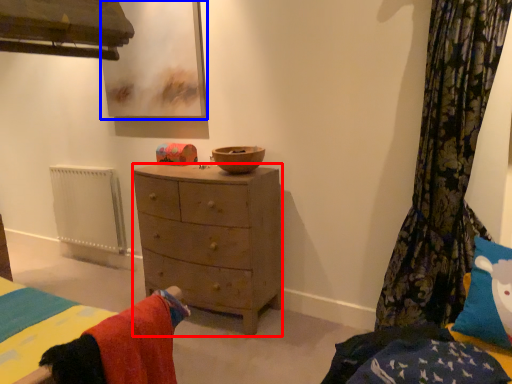
Question: Which object is closer to the camera taking this photo, nightstand (highlighted by a red box) or picture frame (highlighted by a blue box)?

Choices:
 (A) nightstand
 (B) picture frame

Answer: (A)